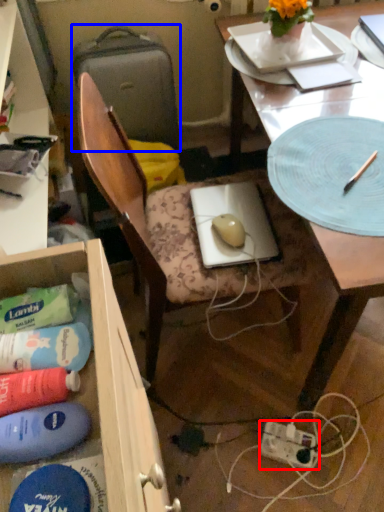
Question: Which point is further to the camera, power plugs and sockets (highlighted by a red box) or suitcase (highlighted by a blue box)?

Choices:
 (A) power plugs and sockets
 (B) suitcase

Answer: (B)